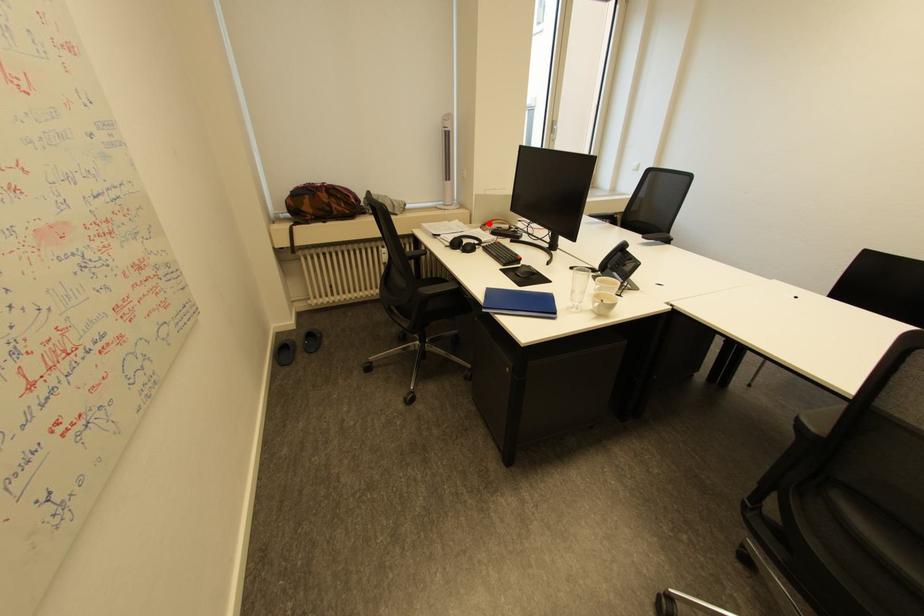
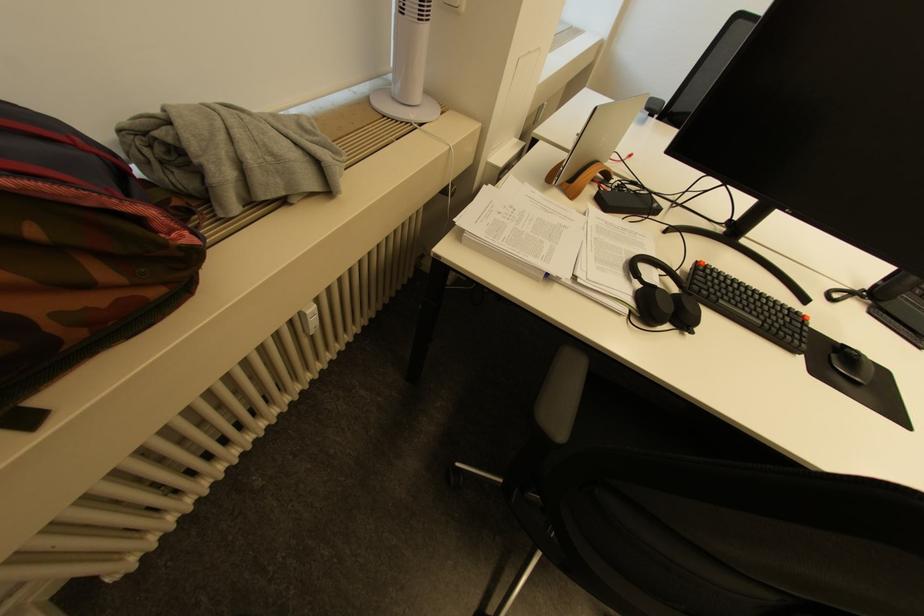
The point at the highlighted location is marked in the first image. Where is the corresponding point in the second image?

(574, 177)